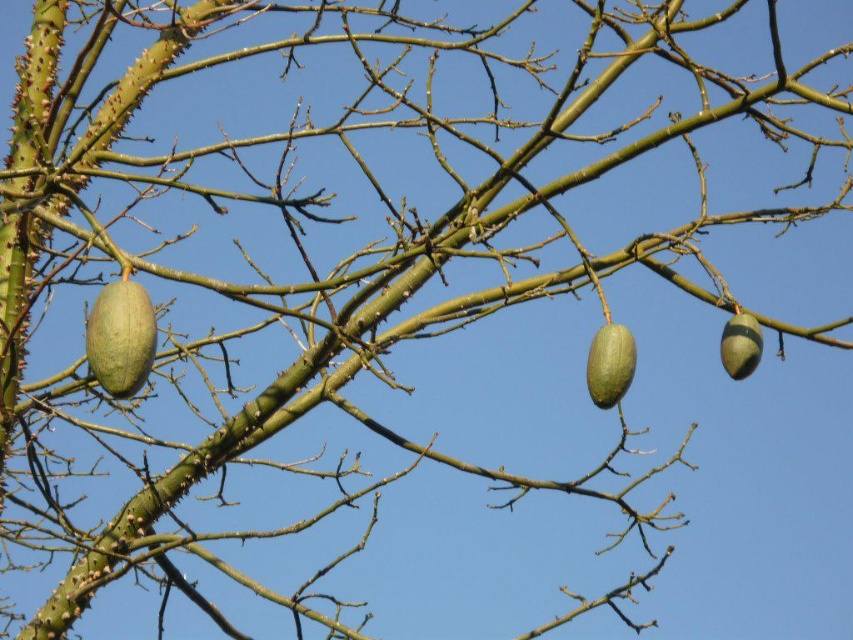
Question: Which is nearer to the green matte fruit at center?

Choices:
 (A) green matte fruit at left
 (B) green matte acorn at right

Answer: (B)

Question: Does green matte fruit at left appear on the left side of green matte acorn at right?

Choices:
 (A) no
 (B) yes

Answer: (B)

Question: Which point is farther to the camera?

Choices:
 (A) green matte fruit at center
 (B) green matte fruit at left

Answer: (A)

Question: Does green matte fruit at left lie behind green matte fruit at center?

Choices:
 (A) no
 (B) yes

Answer: (A)

Question: Among these objects, which one is nearest to the camera?

Choices:
 (A) green matte acorn at right
 (B) green matte fruit at left
 (C) green matte fruit at center

Answer: (B)

Question: Does green matte fruit at center have a greater width compared to green matte acorn at right?

Choices:
 (A) no
 (B) yes

Answer: (A)